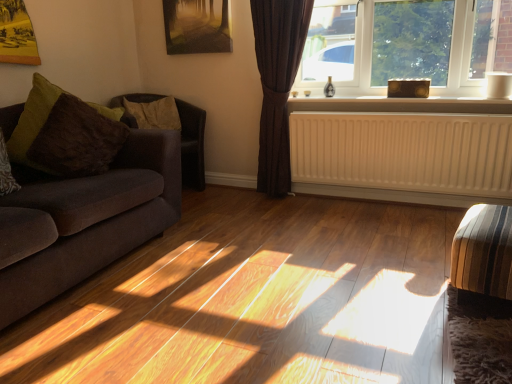
Question: Considering the relative sizes of brown textured pillow at left, which appears as the second pillow when viewed from the front, and matte brown window at upper right in the image provided, is brown textured pillow at left, which appears as the second pillow when viewed from the front, shorter than matte brown window at upper right?

Choices:
 (A) yes
 (B) no

Answer: (A)

Question: Does brown textured pillow at left, which appears as the second pillow when viewed from the front, appear on the right side of matte brown window at upper right?

Choices:
 (A) no
 (B) yes

Answer: (A)

Question: Is brown textured pillow at left, positioned as the 1th pillow in back-to-front order, not close to matte brown window at upper right?

Choices:
 (A) no
 (B) yes

Answer: (B)

Question: From a real-world perspective, is brown textured pillow at left, which appears as the second pillow when viewed from the front, below matte brown window at upper right?

Choices:
 (A) yes
 (B) no

Answer: (A)

Question: From a real-world perspective, is brown textured pillow at left, which appears as the second pillow when viewed from the front, over matte brown window at upper right?

Choices:
 (A) yes
 (B) no

Answer: (B)

Question: Relative to white painted wood at upper center, is brown textured pillow at left, positioned as the 1th pillow in back-to-front order, in front or behind?

Choices:
 (A) behind
 (B) front

Answer: (A)

Question: Choose the correct answer: Is brown textured pillow at left, which appears as the second pillow when viewed from the front, inside white painted wood at upper center or outside it?

Choices:
 (A) inside
 (B) outside

Answer: (B)

Question: Based on their sizes in the image, would you say brown textured pillow at left, positioned as the 1th pillow in back-to-front order, is bigger or smaller than white painted wood at upper center?

Choices:
 (A) small
 (B) big

Answer: (B)

Question: Visually, is brown textured pillow at left, positioned as the 1th pillow in back-to-front order, positioned to the left or to the right of white painted wood at upper center?

Choices:
 (A) right
 (B) left

Answer: (B)

Question: Considering the positions of brown leather armchair at left, acting as the first armchair starting from the top, and brown textured pillow at left, which appears as the second pillow when viewed from the front, in the image, is brown leather armchair at left, acting as the first armchair starting from the top, wider or thinner than brown textured pillow at left, which appears as the second pillow when viewed from the front,?

Choices:
 (A) thin
 (B) wide

Answer: (B)

Question: Would you say brown leather armchair at left, marked as the 2th armchair in a front-to-back arrangement, is to the left or to the right of brown textured pillow at left, positioned as the 1th pillow in back-to-front order, in the picture?

Choices:
 (A) left
 (B) right

Answer: (B)

Question: Would you say brown leather armchair at left, marked as the second armchair in a bottom-to-top arrangement, is inside or outside brown textured pillow at left, positioned as the 1th pillow in back-to-front order?

Choices:
 (A) outside
 (B) inside

Answer: (A)

Question: In terms of height, does brown leather armchair at left, marked as the 2th armchair in a front-to-back arrangement, look taller or shorter compared to brown textured pillow at left, which appears as the second pillow when viewed from the front?

Choices:
 (A) tall
 (B) short

Answer: (A)

Question: From the image's perspective, is wooden textured picture frame at upper center positioned above or below striped fabric armchair at lower right, acting as the 1th armchair starting from the bottom?

Choices:
 (A) above
 (B) below

Answer: (A)

Question: Is point (173, 36) positioned closer to the camera than point (471, 273)?

Choices:
 (A) closer
 (B) farther

Answer: (B)